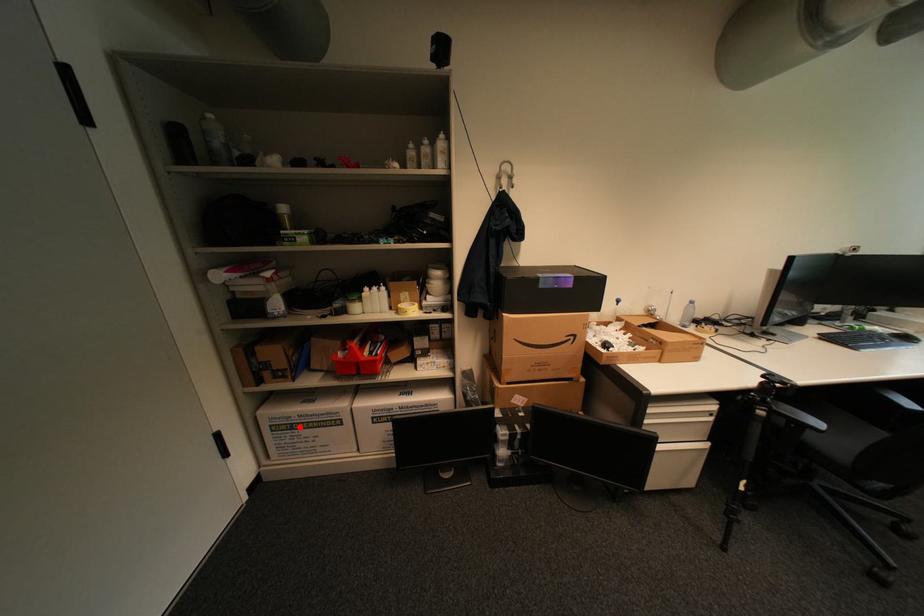
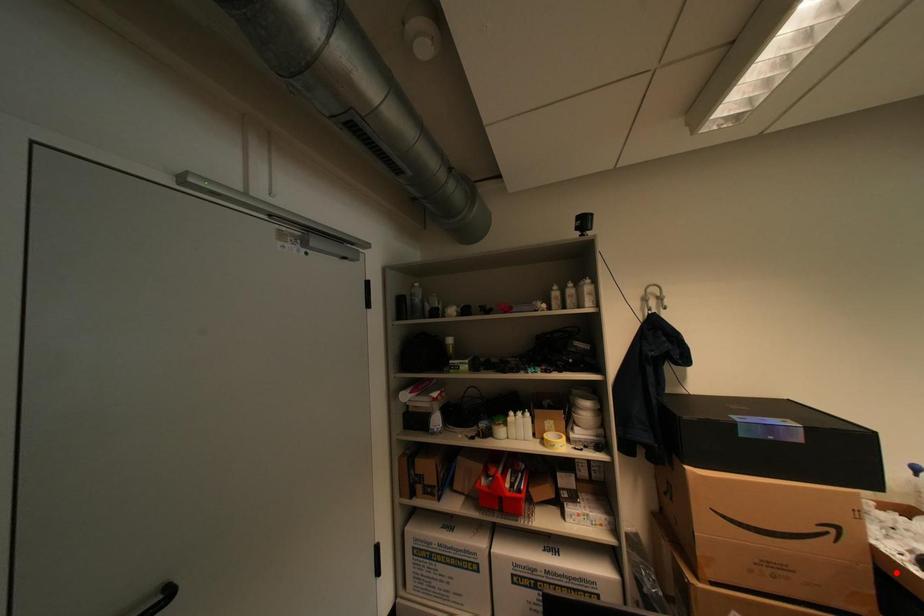
I am providing you with two images of the same scene from different viewpoints. A red point is marked on the first image and another point is marked on the second image. Is the marked point in image1 the same physical position as the marked point in image2?

No